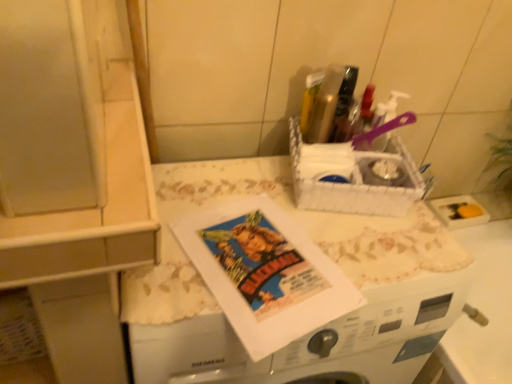
Locate an element on the screen. The width and height of the screenshot is (512, 384). white plastic washing machine at center is located at coordinates (320, 247).

What do you see at coordinates (320, 247) in the screenshot? The height and width of the screenshot is (384, 512). I see `white plastic washing machine at center` at bounding box center [320, 247].

In order to click on white plastic washing machine at center in this screenshot , I will do `click(320, 247)`.